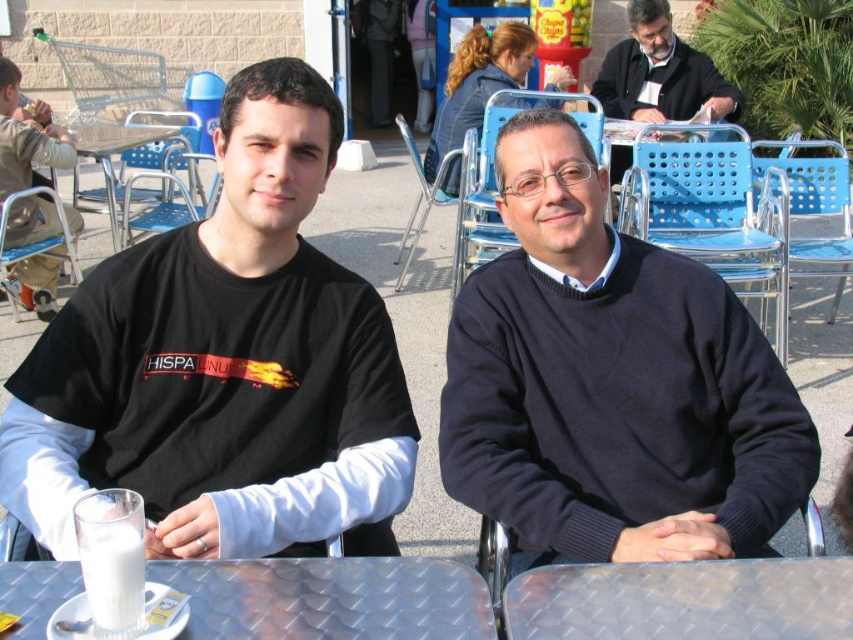
You are a photographer adjusting your camera settings to focus on the dark blue sweater at center. The camera has a focus point at coordinates point (x=610, y=381). Will this focus point land on the dark blue sweater at center?

Yes, the focus point at point (x=610, y=381) is on the dark blue sweater at center, so it will land there.

You are designing a tablecloth for the clear glass table at center. The dark blue sweater at upper right is 40 cm wide. What is the maximum width the tablecloth can be to ensure it fits on the table without overhanging?

The clear glass table at center has a width less than the dark blue sweater at upper right, which is 40 cm wide. Therefore, the maximum width the tablecloth can be is just under 40 cm to ensure it fits without overhanging.

You are a photographer setting up for a portrait. You need to position a light source so that it illuminates both the dark blue sweater at center and the metallic diamond plate table at center without causing glare on the table. Based on their positions, where should you place the light source relative to the photographer?

The metallic diamond plate table at center is behind the dark blue sweater at center. To avoid glare on the table, place the light source in front of the dark blue sweater at center so that it faces the photographer, ensuring the light hits the sweater directly while the table, being behind, won not reflect glare towards the camera.